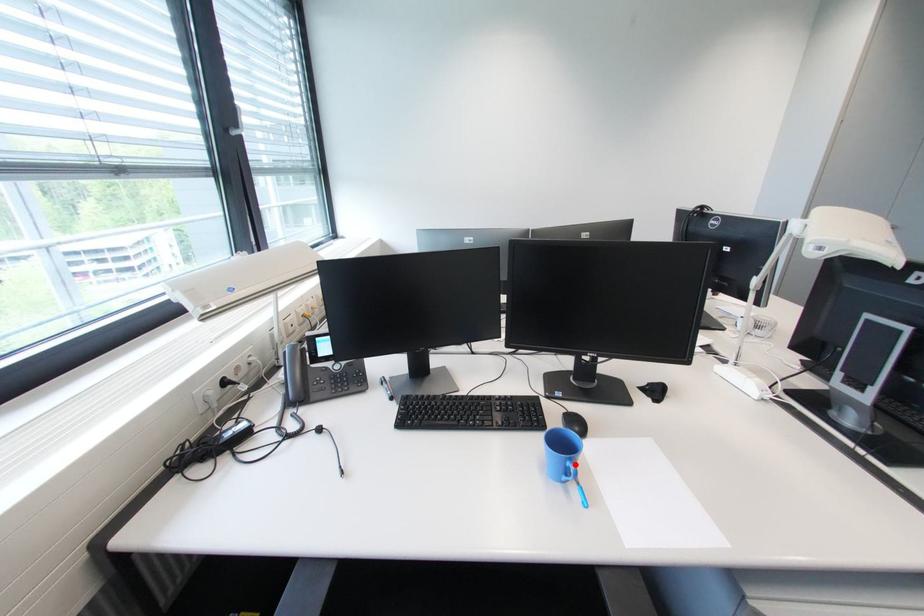
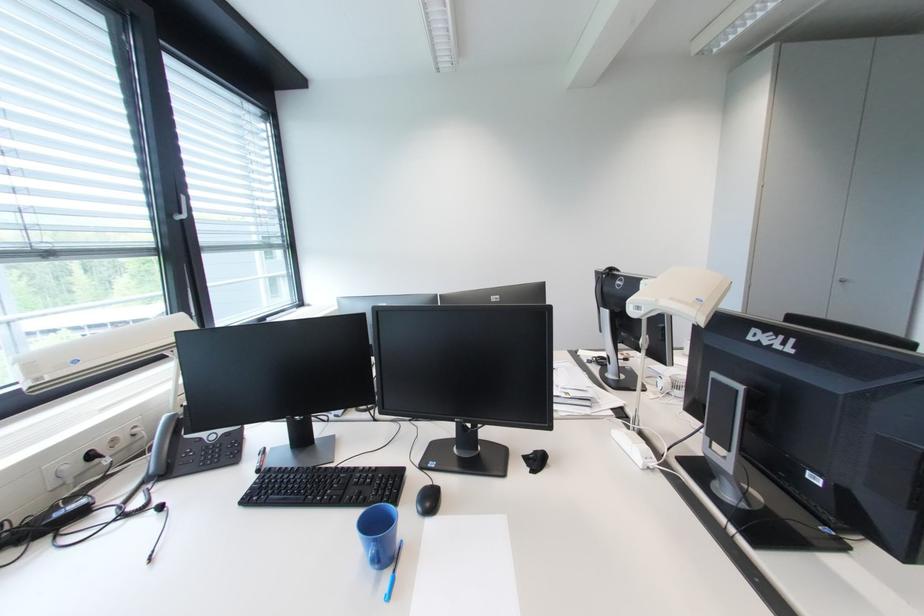
In the second image, find the point that corresponds to the highlighted location in the first image.

(379, 546)